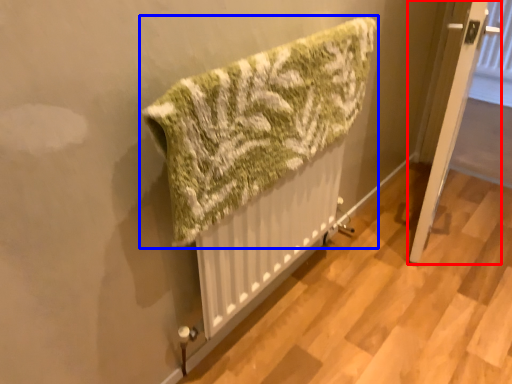
Question: Which object appears closest to the camera in this image, door (highlighted by a red box) or towel (highlighted by a blue box)?

Choices:
 (A) door
 (B) towel

Answer: (B)